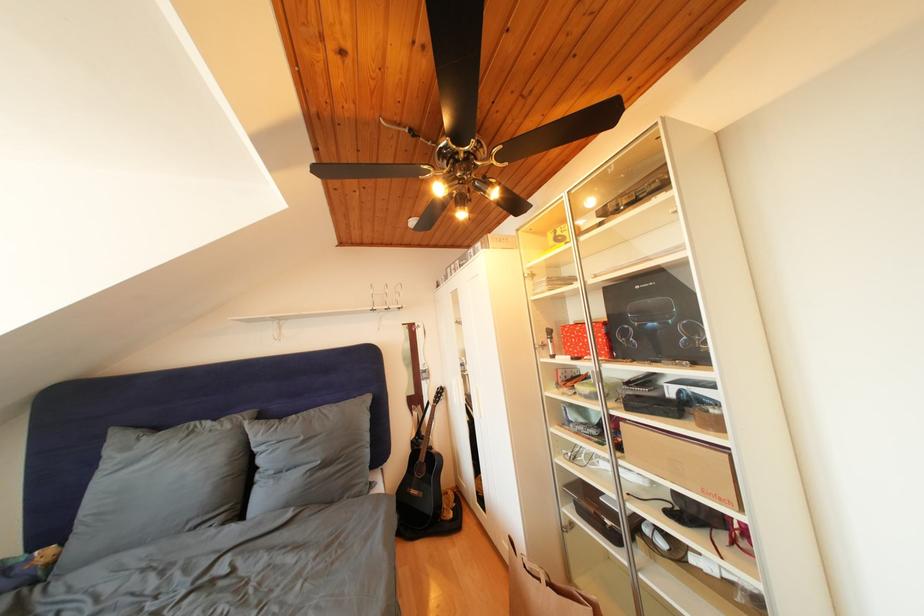
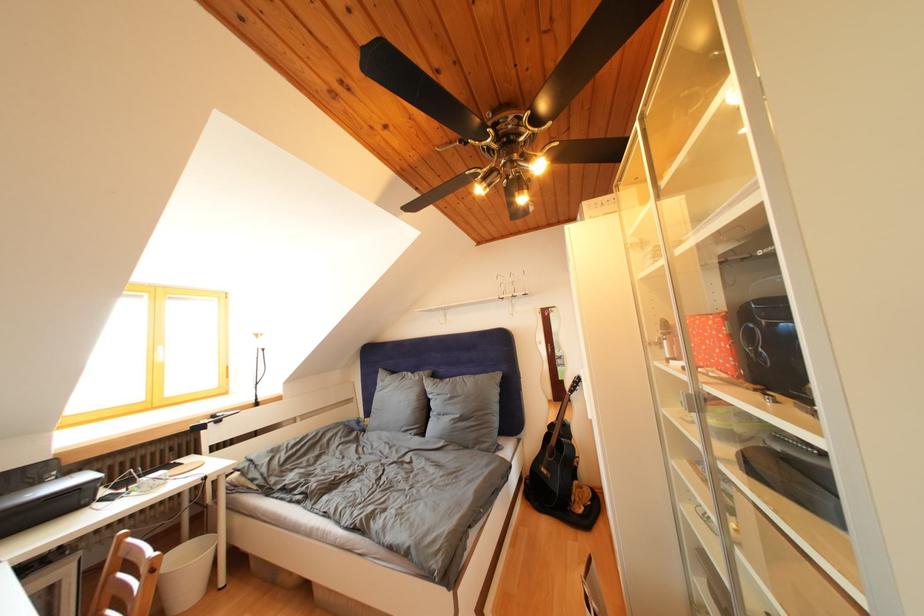
Where in the second image is the point corresponding to the point at 165,434 from the first image?

(400, 378)